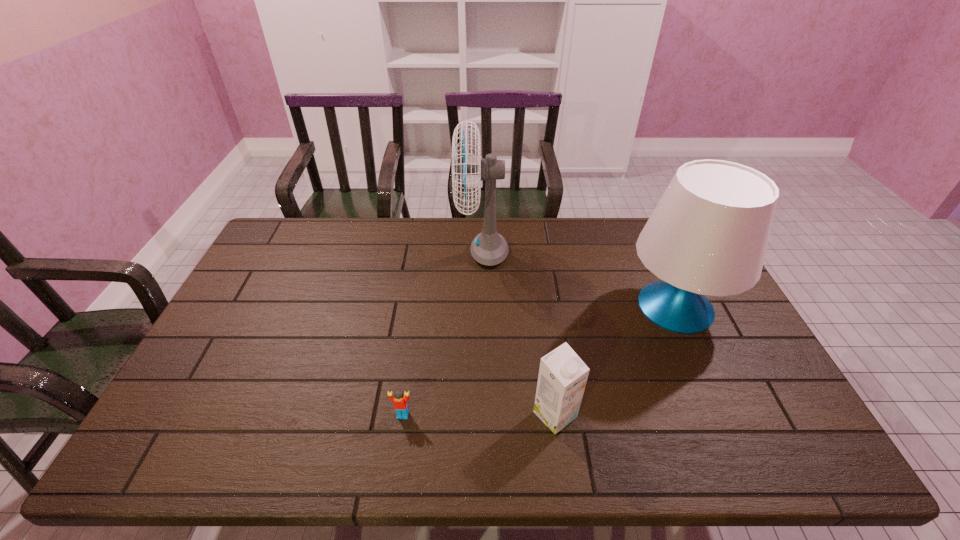
You are a GUI agent. You are given a task and a screenshot of the screen. Output one action in this format:
    pyautogui.click(x=<x>, y=<y>)
    Task: Click on the vacant area situated 0.400m on the front-facing side of the table lamp
    The image size is (960, 540).
    Given the screenshot: What is the action you would take?
    pyautogui.click(x=492, y=307)

Locate an element on the screen. Image resolution: width=960 pixels, height=540 pixels. vacant space located 0.350m on the front-facing side of the table lamp is located at coordinates (508, 307).

In order to click on vacant space located on the left of the third tallest object in this screenshot , I will do `click(407, 415)`.

Find the location of `free region located 0.070m on the face of the shortest object`. free region located 0.070m on the face of the shortest object is located at coordinates (398, 447).

Find the location of a particular element. Image resolution: width=960 pixels, height=540 pixels. object present at the far edge is located at coordinates (489, 248).

In order to click on object present at the near edge in this screenshot , I will do `click(562, 378)`.

The height and width of the screenshot is (540, 960). Find the location of `object that is at the right edge`. object that is at the right edge is located at coordinates (708, 235).

The width and height of the screenshot is (960, 540). In the image, there is a desktop. Find the location of `free space at the far edge`. free space at the far edge is located at coordinates (422, 231).

This screenshot has width=960, height=540. I want to click on free space at the near edge of the desktop, so click(292, 458).

Identify the location of free point at the left edge. This screenshot has width=960, height=540. (248, 295).